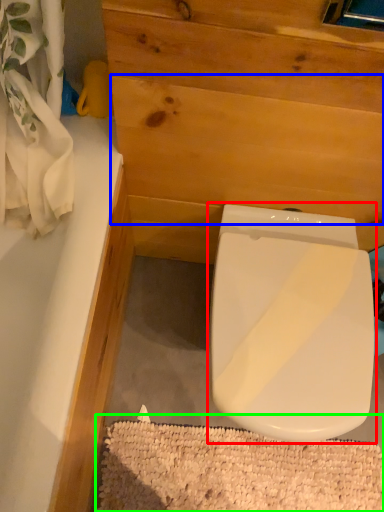
Question: Which object is positioned farthest from toilet (highlighted by a red box)? Select from plywood (highlighted by a blue box) and bath mat (highlighted by a green box).

Choices:
 (A) plywood
 (B) bath mat

Answer: (B)